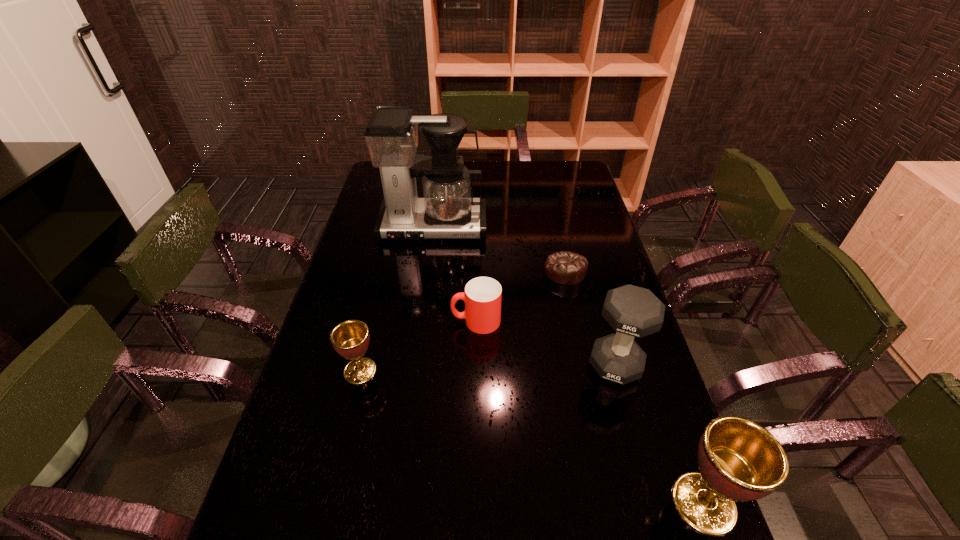
Image resolution: width=960 pixels, height=540 pixels. I want to click on object that stands as the fifth closest to the shorter chalice, so click(739, 460).

This screenshot has width=960, height=540. I want to click on vacant position in the image that satisfies the following two spatial constraints: 1. on the front side of the dumbbell; 2. on the left side of the beanbag, so click(586, 365).

In order to click on free space that satisfies the following two spatial constraints: 1. on the side of the second farthest object with the handle; 2. on the right side of the cup in this screenshot , I will do `click(476, 271)`.

Where is `vacant space that satisfies the following two spatial constraints: 1. at the front of the tallest object where the controls are located; 2. on the right side of the dumbbell`? vacant space that satisfies the following two spatial constraints: 1. at the front of the tallest object where the controls are located; 2. on the right side of the dumbbell is located at coordinates (414, 365).

Where is `vacant space that satisfies the following two spatial constraints: 1. at the front of the tallest object where the controls are located; 2. on the side of the cup with the handle`? The width and height of the screenshot is (960, 540). vacant space that satisfies the following two spatial constraints: 1. at the front of the tallest object where the controls are located; 2. on the side of the cup with the handle is located at coordinates (420, 321).

Identify the location of vacant area in the image that satisfies the following two spatial constraints: 1. at the front of the tallest object where the controls are located; 2. on the side of the third farthest object with the handle. This screenshot has height=540, width=960. (420, 321).

This screenshot has height=540, width=960. What are the coordinates of `free space that satisfies the following two spatial constraints: 1. on the side of the third farthest object with the handle; 2. at the front of the farthest object where the controls are located` in the screenshot? It's located at (477, 227).

You are a GUI agent. You are given a task and a screenshot of the screen. Output one action in this format:
    pyautogui.click(x=<x>, y=<y>)
    Task: Click on the vacant area in the image that satisfies the following two spatial constraints: 1. on the side of the second farthest object with the handle; 2. on the left side of the fourth nearest object
    The image size is (960, 540).
    Given the screenshot: What is the action you would take?
    pyautogui.click(x=476, y=271)

Find the location of a particular element. blank area in the image that satisfies the following two spatial constraints: 1. at the front of the farthest object where the controls are located; 2. on the side of the fourth nearest object with the handle is located at coordinates (420, 321).

Locate an element on the screen. Image resolution: width=960 pixels, height=540 pixels. free space that satisfies the following two spatial constraints: 1. on the front side of the beanbag; 2. on the right side of the dumbbell is located at coordinates (586, 365).